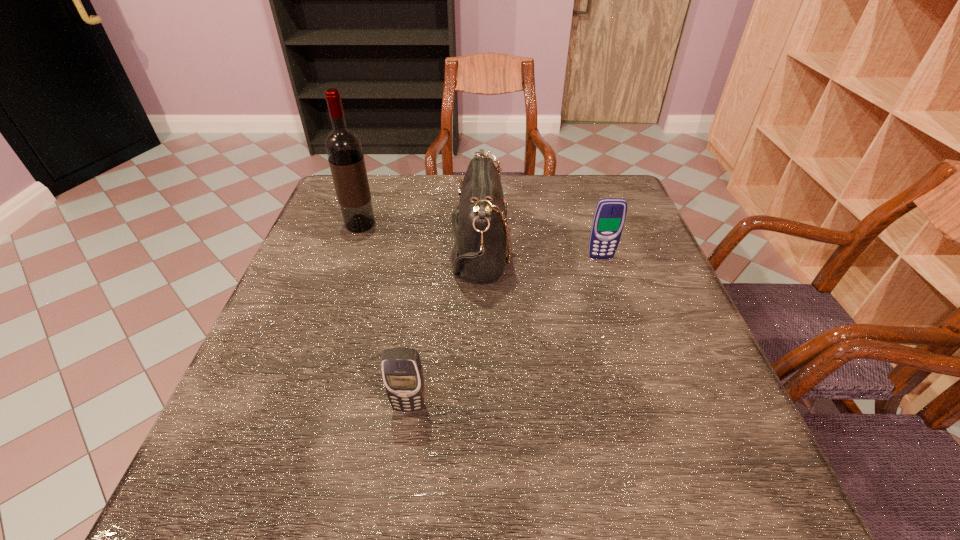
At what (x,y) coordinates should I click in order to perform the action: click on empty space between the leftmost object and the second object from right to left. Please return your answer as a coordinate pair (x, y). Image resolution: width=960 pixels, height=540 pixels. Looking at the image, I should click on (420, 237).

I want to click on vacant area that lies between the nearer cellular telephone and the handbag, so (444, 328).

I want to click on object that is the closest one to the third object from left to right, so click(609, 218).

Locate an element on the screen. This screenshot has height=540, width=960. object that is the nearest to the leftmost object is located at coordinates (481, 235).

Image resolution: width=960 pixels, height=540 pixels. I want to click on free space that satisfies the following two spatial constraints: 1. at the front of the third object from left to right with chain and zipper; 2. on the front face of the left cellular telephone, so click(x=478, y=406).

Locate an element on the screen. The height and width of the screenshot is (540, 960). vacant space that satisfies the following two spatial constraints: 1. at the front of the third object from left to right with chain and zipper; 2. on the front face of the left cellular telephone is located at coordinates (478, 406).

You are a GUI agent. You are given a task and a screenshot of the screen. Output one action in this format:
    pyautogui.click(x=<x>, y=<y>)
    Task: Click on the vacant space that satisfies the following two spatial constraints: 1. at the front of the third object from left to right with chain and zipper; 2. on the front face of the nearest object
    The width and height of the screenshot is (960, 540).
    Given the screenshot: What is the action you would take?
    pyautogui.click(x=478, y=406)